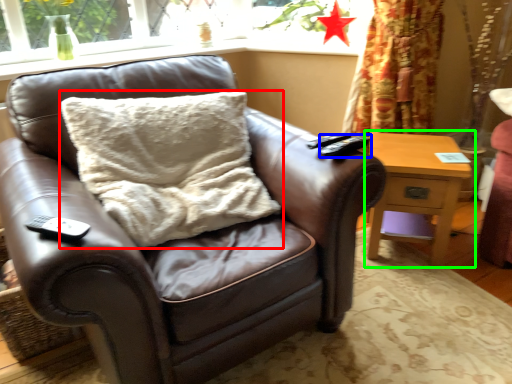
Question: Based on their relative distances, which object is farther from pillow (highlighted by a red box)? Choose from remote (highlighted by a blue box) and nightstand (highlighted by a green box).

Choices:
 (A) remote
 (B) nightstand

Answer: (B)